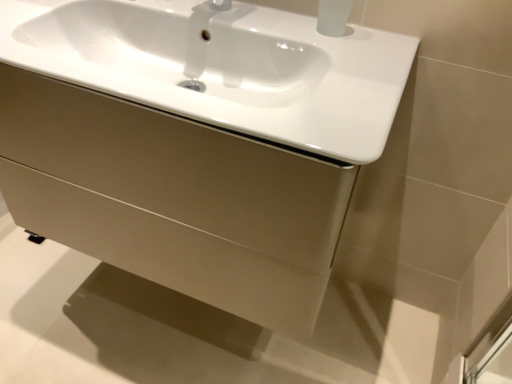
Question: Is matte beige drawer at center to the left of white glossy sink at center from the viewer's perspective?

Choices:
 (A) no
 (B) yes

Answer: (B)

Question: Can you confirm if matte beige drawer at center is positioned to the right of white glossy sink at center?

Choices:
 (A) no
 (B) yes

Answer: (A)

Question: Can you confirm if matte beige drawer at center is wider than white glossy sink at center?

Choices:
 (A) no
 (B) yes

Answer: (B)

Question: Is matte beige drawer at center closer to the viewer compared to white glossy sink at center?

Choices:
 (A) yes
 (B) no

Answer: (B)

Question: From the image's perspective, is matte beige drawer at center beneath white glossy sink at center?

Choices:
 (A) yes
 (B) no

Answer: (A)

Question: Is matte beige drawer at center facing away from white glossy sink at center?

Choices:
 (A) no
 (B) yes

Answer: (A)

Question: Considering the relative sizes of white glossy sink at center and matte beige drawer at center in the image provided, is white glossy sink at center thinner than matte beige drawer at center?

Choices:
 (A) no
 (B) yes

Answer: (B)

Question: Is white glossy sink at center bigger than matte beige drawer at center?

Choices:
 (A) no
 (B) yes

Answer: (A)

Question: Is the depth of white glossy sink at center greater than that of matte beige drawer at center?

Choices:
 (A) no
 (B) yes

Answer: (A)

Question: Is white glossy sink at center in front of matte beige drawer at center?

Choices:
 (A) no
 (B) yes

Answer: (B)

Question: From the image's perspective, would you say white glossy sink at center is shown under matte beige drawer at center?

Choices:
 (A) no
 (B) yes

Answer: (A)

Question: Considering the relative sizes of white glossy sink at center and matte beige drawer at center in the image provided, is white glossy sink at center smaller than matte beige drawer at center?

Choices:
 (A) yes
 (B) no

Answer: (A)

Question: From the image's perspective, is matte beige drawer at center located above or below white glossy sink at center?

Choices:
 (A) below
 (B) above

Answer: (A)